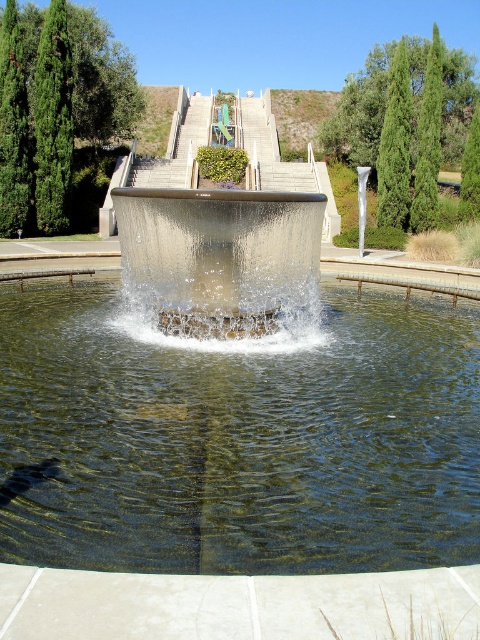
You are a maintenance worker inspecting the water features in the park. You notice both the clear glass pond at center and the clear glass water feature at center. Which one has a larger size according to the description?

The clear glass water feature at center is larger than the clear glass pond at center.

You are a maintenance worker inspecting the clear glass pond at center and the clear glass water feature at center. According to the scene description, which object is positioned lower in the image?

The clear glass pond at center is located below the clear glass water feature at center, so it is positioned lower in the image.

You are a maintenance worker who needs to clean both the clear glass pond at center and the clear glass water feature at center. Which one requires you to reach higher to clean its top surface?

The clear glass water feature at center requires reaching higher because it is taller than the clear glass pond at center.